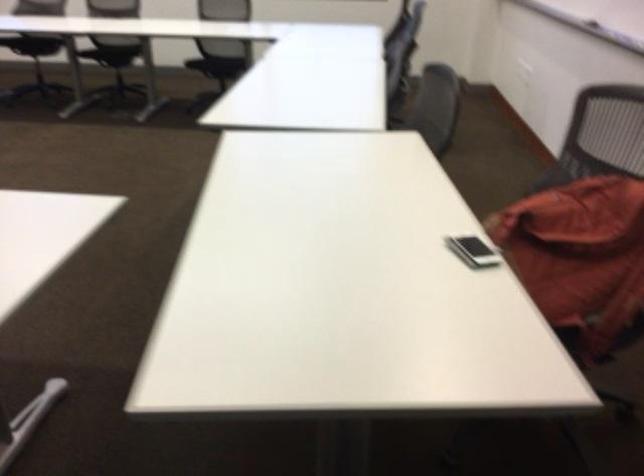
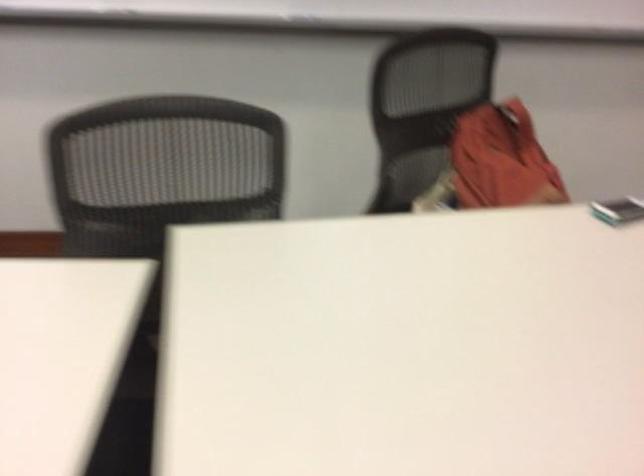
Locate, in the second image, the point that corresponds to [455,248] in the first image.

(618, 210)